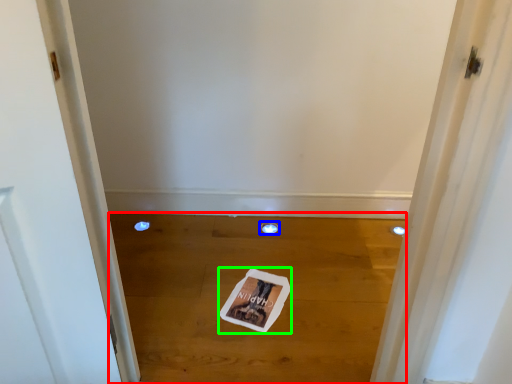
Question: Which object is the farthest from plain (highlighted by a red box)? Choose among these: hole (highlighted by a blue box) or magazine (highlighted by a green box).

Choices:
 (A) hole
 (B) magazine

Answer: (A)